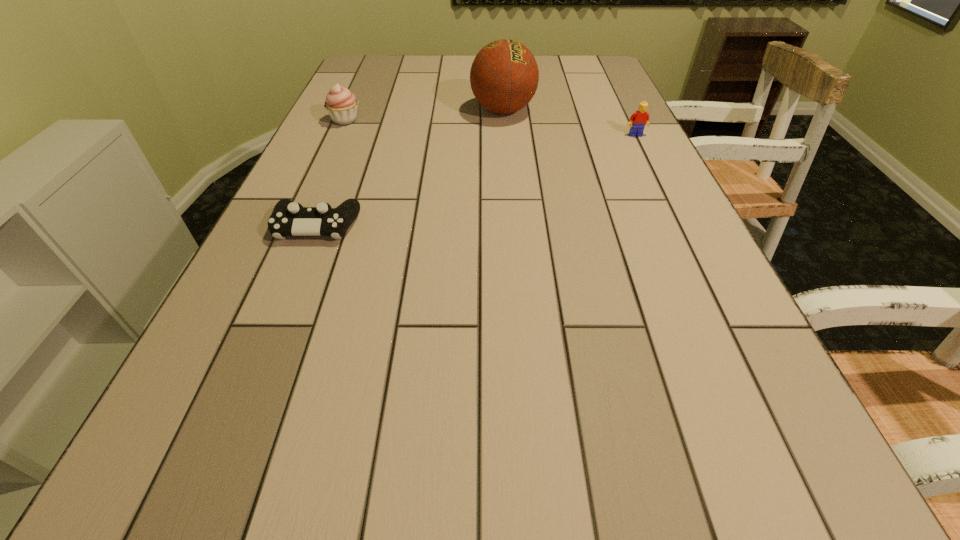
At what (x,y) coordinates should I click in order to perform the action: click on vacant space situated 0.200m on the surface of the control. Please return your answer as a coordinate pair (x, y). This screenshot has height=540, width=960. Looking at the image, I should click on (277, 322).

Image resolution: width=960 pixels, height=540 pixels. In order to click on cupcake that is positioned at the left edge in this screenshot , I will do `click(341, 104)`.

Identify the location of control positioned at the left edge. (288, 218).

This screenshot has width=960, height=540. I want to click on object at the right edge, so (x=638, y=120).

Identify the location of vacant space at the far edge. (466, 65).

The image size is (960, 540). In order to click on vacant area at the left edge in this screenshot , I will do point(359,135).

Identify the location of vacant space at the right edge of the desktop. Image resolution: width=960 pixels, height=540 pixels. (604, 125).

Identify the location of blank space at the far left corner of the desktop. The height and width of the screenshot is (540, 960). pyautogui.click(x=373, y=66).

In the image, there is a desktop. At what (x,y) coordinates should I click in order to perform the action: click on vacant space at the far right corner. Please return your answer as a coordinate pair (x, y). Looking at the image, I should click on (582, 73).

This screenshot has height=540, width=960. What are the coordinates of `vacant space that's between the nearest object and the second nearest object` in the screenshot? It's located at (476, 180).